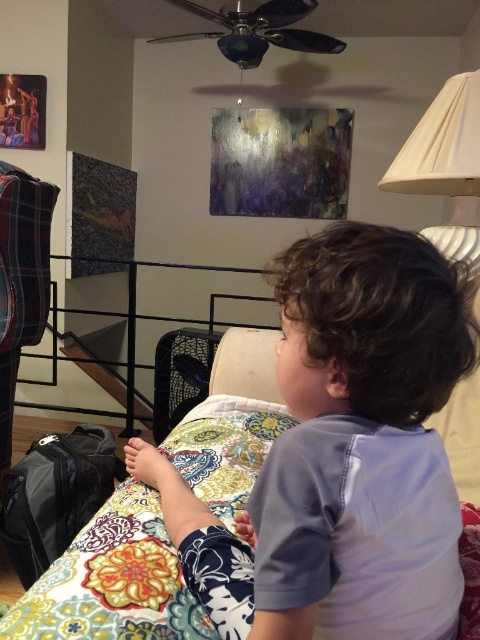
Does floral patchwork quilt at lower center lie behind black fabric suitcase at lower left?

No.

Who is more forward, (130, 596) or (76, 468)?

Point (130, 596) is in front.

What are the coordinates of `floral patchwork quilt at lower center` in the screenshot? It's located at [112, 580].

Which of these two, black fabric suitcase at lower left or white pleated lampshade at upper right, stands shorter?

black fabric suitcase at lower left is shorter.

Is black fabric suitcase at lower left behind white pleated lampshade at upper right?

Yes, black fabric suitcase at lower left is further from the viewer.

Between point (83, 460) and point (455, 163), which one is positioned behind?

Point (83, 460)

Find the location of a particular element. The width and height of the screenshot is (480, 640). black fabric suitcase at lower left is located at coordinates (x=55, y=496).

Can you confirm if light blue cotton shirt at center is taller than white pleated lampshade at upper right?

In fact, light blue cotton shirt at center may be shorter than white pleated lampshade at upper right.

Is light blue cotton shirt at center further to camera compared to white pleated lampshade at upper right?

No, it is not.

Is point (279, 275) positioned behind point (472, 189)?

No, (279, 275) is in front of (472, 189).

Identify the location of light blue cotton shirt at center. (347, 449).